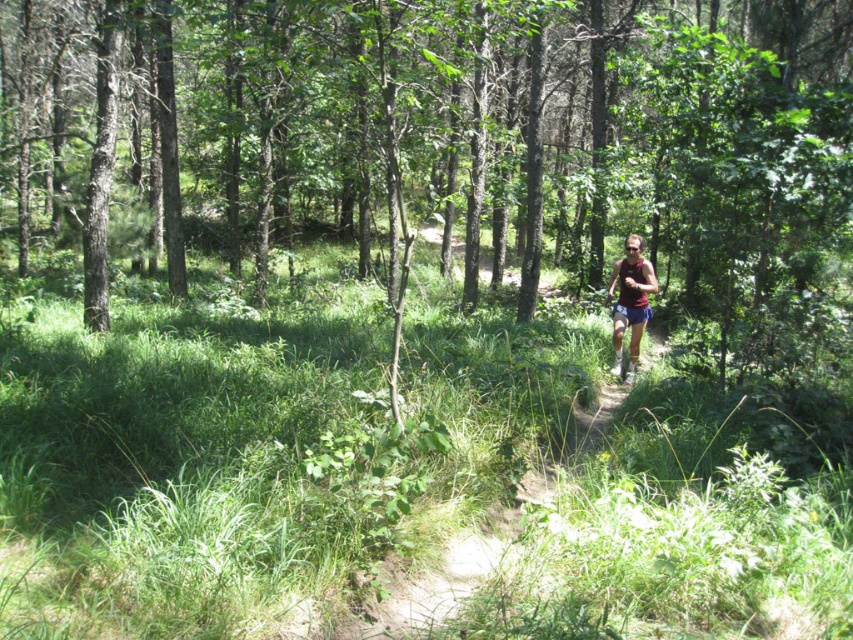
Question: Does brown bark tree at center appear on the left side of maroon fabric shorts at center?

Choices:
 (A) yes
 (B) no

Answer: (A)

Question: Can you confirm if brown bark tree at center is wider than maroon fabric shorts at center?

Choices:
 (A) yes
 (B) no

Answer: (A)

Question: Which object appears closest to the camera in this image?

Choices:
 (A) brown bark tree at center
 (B) maroon fabric shorts at center

Answer: (A)

Question: Where is brown bark tree at center located in relation to maroon fabric shorts at center in the image?

Choices:
 (A) left
 (B) right

Answer: (A)